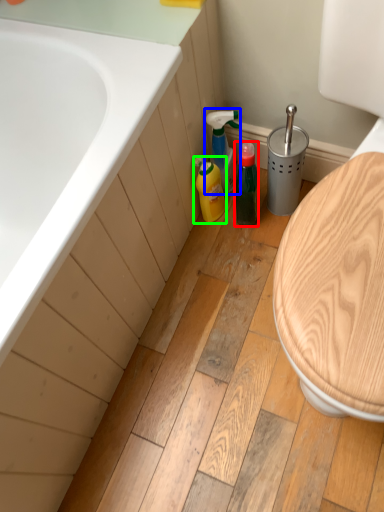
Question: Based on their relative distances, which object is farther from bottle (highlighted by a red box)? Choose from cleaning product (highlighted by a blue box) and cleaning product (highlighted by a green box).

Choices:
 (A) cleaning product
 (B) cleaning product

Answer: (A)